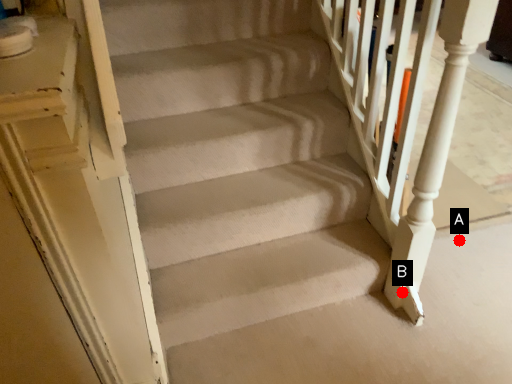
Question: Two points are circled on the image, labeled by A and B beside each circle. Which of the following is the farthest from the observer?

Choices:
 (A) A is further
 (B) B is further

Answer: (A)